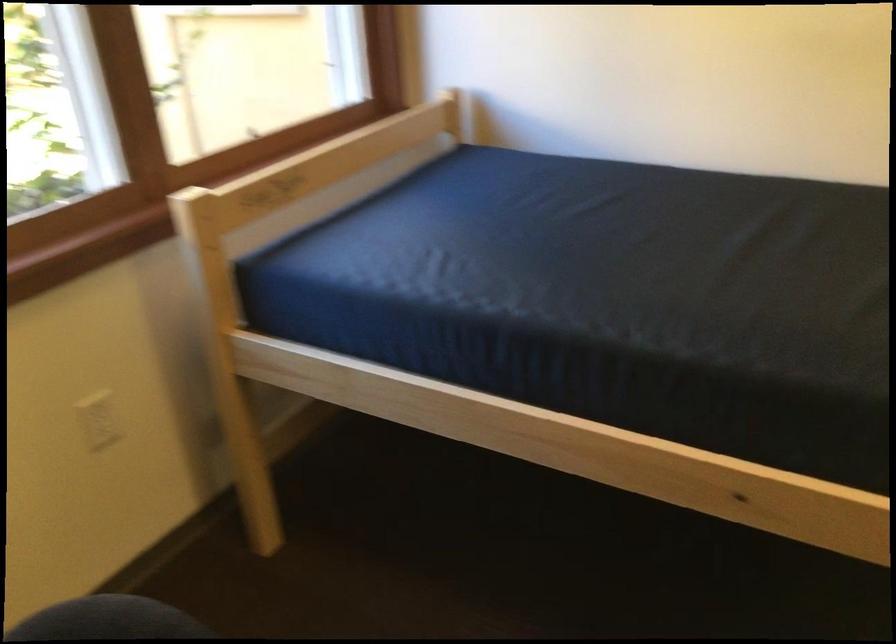
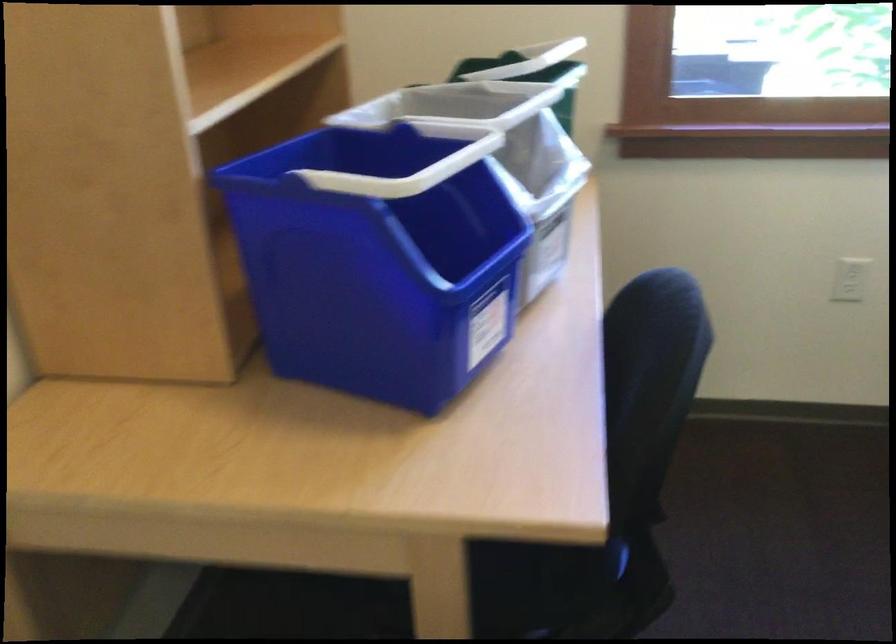
The images are taken continuously from a first-person perspective. In which direction is your viewpoint rotating?

The camera's rotation is toward left-down.